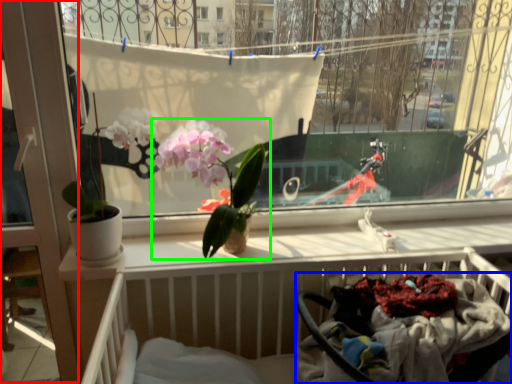
Question: Which is nearer to the screen door (highlighted by a red box)? baby carriage (highlighted by a blue box) or houseplant (highlighted by a green box).

Choices:
 (A) baby carriage
 (B) houseplant

Answer: (B)